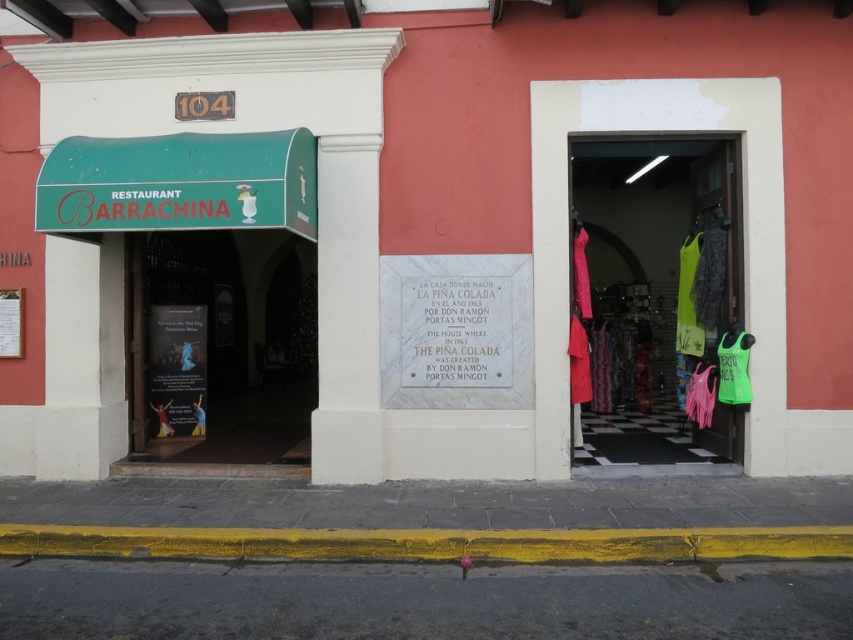
Who is more distant from viewer, (689, 317) or (196, 406)?

The point (196, 406) is behind.

At what (x,y) coordinates should I click in order to perform the action: click on neon green fabric at center. Please return your answer as a coordinate pair (x, y). The width and height of the screenshot is (853, 640). Looking at the image, I should click on (657, 285).

This screenshot has width=853, height=640. I want to click on neon green fabric at center, so click(x=657, y=285).